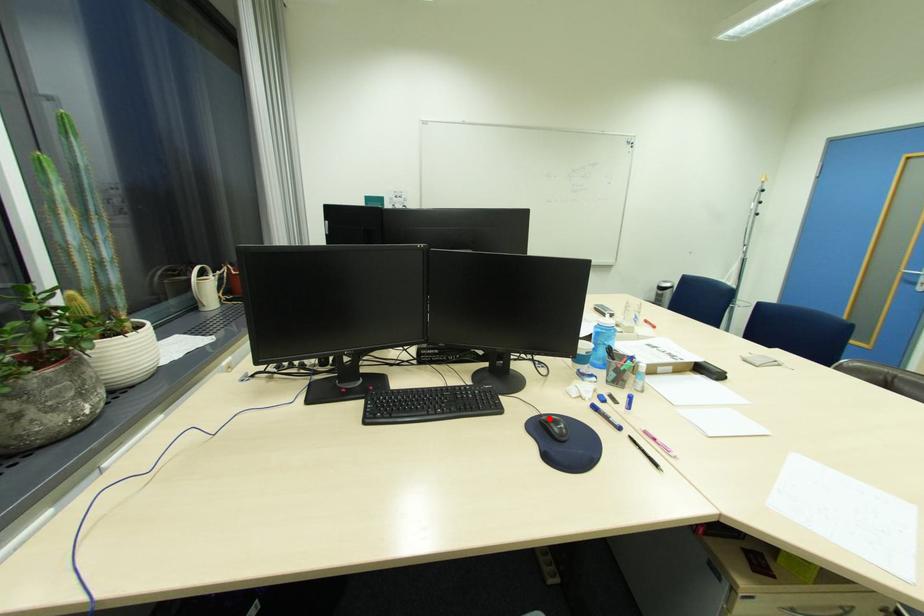
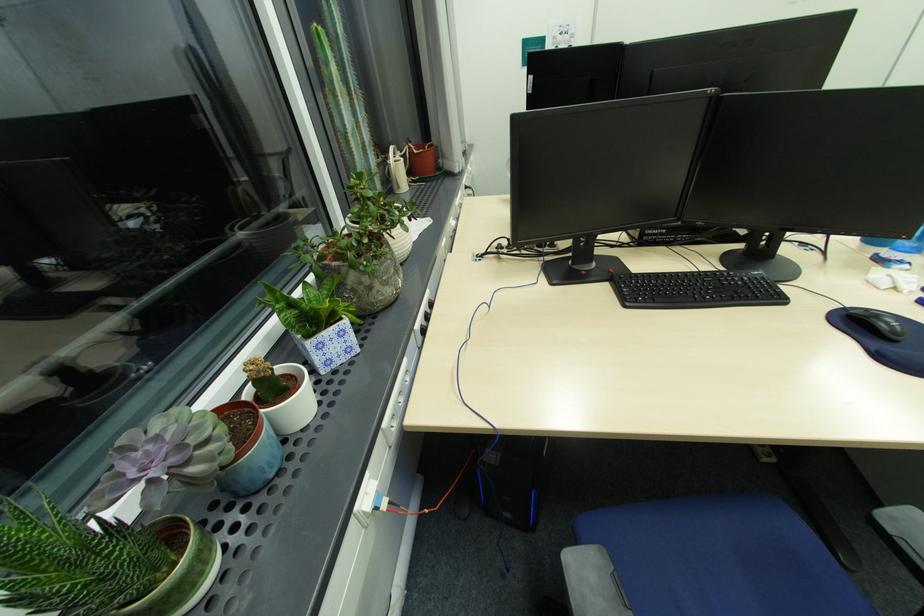
Where in the second image is the point corresponding to the highlighted location from the first image?

(857, 312)